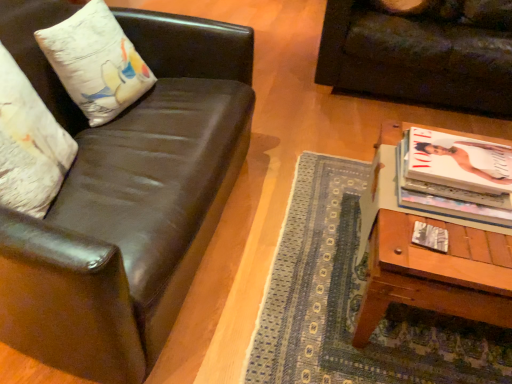
Question: Considering the relative positions of white glossy magazine at right and shiny black leather couch at left, arranged as the second studio couch when viewed from the right, in the image provided, is white glossy magazine at right to the left or to the right of shiny black leather couch at left, arranged as the second studio couch when viewed from the right,?

Choices:
 (A) right
 (B) left

Answer: (A)

Question: From a real-world perspective, relative to shiny black leather couch at left, which is the 1th studio couch from front to back, is white glossy magazine at right vertically above or below?

Choices:
 (A) below
 (B) above

Answer: (B)

Question: Which of these objects is positioned farthest from the white cotton pillow at upper left, the first pillow positioned from the back?

Choices:
 (A) dark brown leather couch at upper right, arranged as the 1th studio couch when viewed from the back
 (B) white glossy magazine at right
 (C) matte white magazine at right
 (D) shiny black leather couch at left, arranged as the second studio couch when viewed from the right
 (E) white textured pillow at left, the second pillow from the back

Answer: (A)

Question: Which object is positioned closest to the shiny black leather couch at left, which ranks as the 1th studio couch in left-to-right order?

Choices:
 (A) white glossy magazine at right
 (B) matte white magazine at right
 (C) dark brown leather couch at upper right, arranged as the 1th studio couch when viewed from the back
 (D) wooden table at lower right
 (E) white textured pillow at left, the second pillow from the back

Answer: (E)